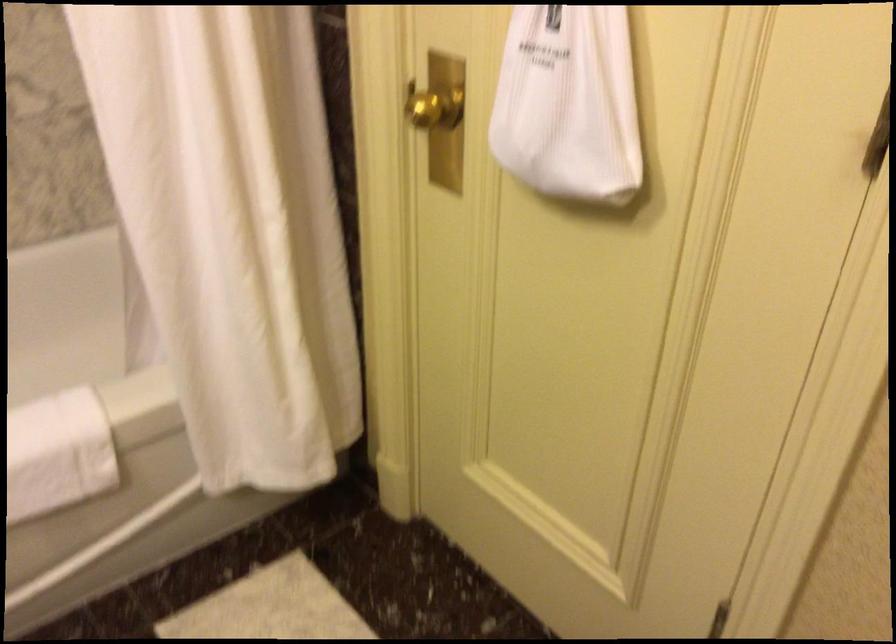
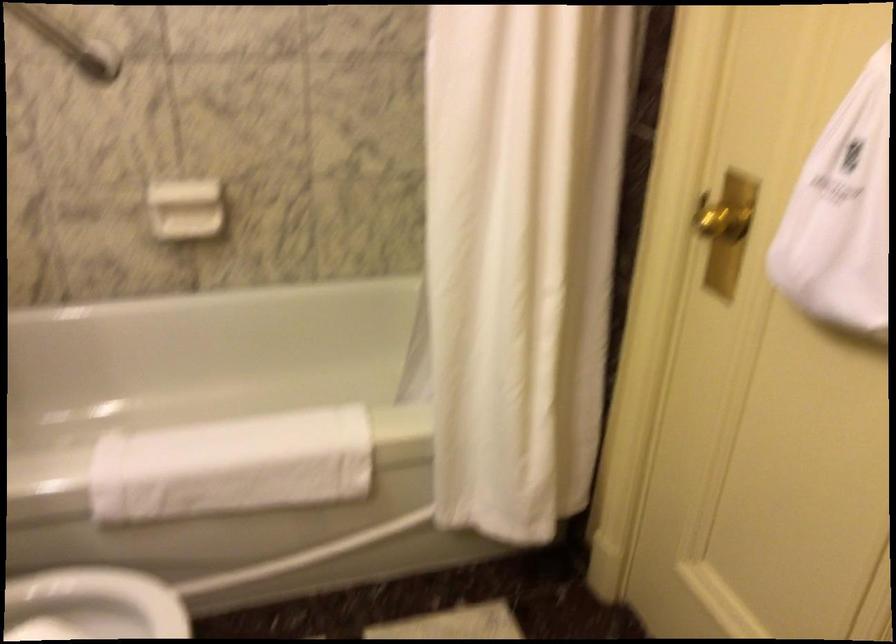
Question: The camera is either moving clockwise (left) or counter-clockwise (right) around the object. The first image is from the beginning of the video and the second image is from the end. Is the camera moving left or right when shooting the video?

Choices:
 (A) Left
 (B) Right

Answer: (B)